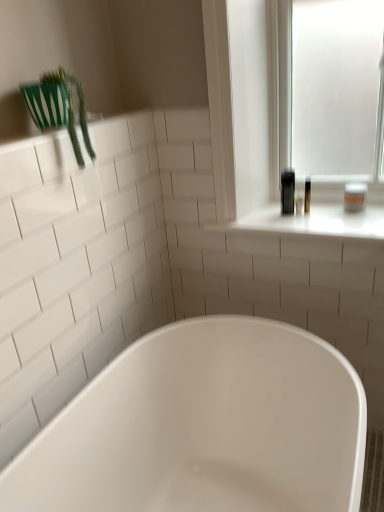
Measure the distance between point (80, 159) and camera.

Point (80, 159) and camera are 3.77 feet apart.

You are a GUI agent. You are given a task and a screenshot of the screen. Output one action in this format:
    pyautogui.click(x=<x>, y=<y>)
    Task: Click on the white glossy window sill at upper right
    
    Given the screenshot: What is the action you would take?
    pyautogui.click(x=309, y=223)

Describe the element at coordinates (204, 426) in the screenshot. I see `white glossy bathtub at center` at that location.

Measure the distance between white glossy bathtub at center and camera.

white glossy bathtub at center is 33.08 inches from camera.

You are a GUI agent. You are given a task and a screenshot of the screen. Output one action in this format:
    pyautogui.click(x=<x>, y=<y>)
    Task: Click on the green plastic plant at upper left
    This screenshot has height=512, width=384.
    Given the screenshot: What is the action you would take?
    pyautogui.click(x=72, y=110)

From the image's perspective, is green plastic plant at upper left below white glossy bathtub at center?

No, from the image's perspective, green plastic plant at upper left is not beneath white glossy bathtub at center.

What's the angular difference between green plastic plant at upper left and white glossy bathtub at center's facing directions?

There is a 0.916-degree angle between the facing directions of green plastic plant at upper left and white glossy bathtub at center.

Consider the image. Considering the sizes of objects green plastic plant at upper left and white glossy bathtub at center in the image provided, who is taller, green plastic plant at upper left or white glossy bathtub at center?

With more height is white glossy bathtub at center.

In the image, there is a white glossy bathtub at center. At what (x,y) coordinates should I click in order to perform the action: click on plant above it (from the image's perspective). Please return your answer as a coordinate pair (x, y). This screenshot has width=384, height=512. Looking at the image, I should click on (72, 110).

Is white glossy window sill at upper right positioned with its back to white matte jar at upper right?

No, white glossy window sill at upper right is not facing the opposite direction of white matte jar at upper right.

From the image's perspective, which one is positioned lower, white glossy window sill at upper right or white matte jar at upper right?

white glossy window sill at upper right is shown below in the image.

Is white glossy window sill at upper right not inside white matte jar at upper right?

That's correct, white glossy window sill at upper right is outside of white matte jar at upper right.

Does white glossy window sill at upper right have a smaller size compared to white matte jar at upper right?

No.

In the scene shown: Is white matte jar at upper right not inside green plastic plant at upper left?

Yes, white matte jar at upper right is not within green plastic plant at upper left.

Which object is closer to the camera taking this photo, white matte jar at upper right or green plastic plant at upper left?

green plastic plant at upper left is in front.

Where is `plant on the left side of white matte jar at upper right`? The image size is (384, 512). plant on the left side of white matte jar at upper right is located at coordinates (72, 110).

Between point (356, 201) and point (303, 234), which one is positioned in front?

The point (303, 234) is closer to the camera.

From the picture: Can you confirm if white matte jar at upper right is smaller than white glossy window sill at upper right?

Indeed, white matte jar at upper right has a smaller size compared to white glossy window sill at upper right.

In the scene shown: Is white matte jar at upper right wider or thinner than white glossy window sill at upper right?

Considering their sizes, white matte jar at upper right looks slimmer than white glossy window sill at upper right.

How distant is white matte jar at upper right from white glossy window sill at upper right?

white matte jar at upper right is 6.68 inches away from white glossy window sill at upper right.

Could white glossy window sill at upper right be considered to be inside green plastic plant at upper left?

That's incorrect, white glossy window sill at upper right is not inside green plastic plant at upper left.

Consider the image. From the image's perspective, between green plastic plant at upper left and white glossy window sill at upper right, which one is located above?

From the image's view, green plastic plant at upper left is above.

Is green plastic plant at upper left facing away from white glossy window sill at upper right?

No, green plastic plant at upper left is not facing away from white glossy window sill at upper right.

Find the location of a particular element. plant above the white glossy window sill at upper right (from a real-world perspective) is located at coordinates (72, 110).

Does point (305, 224) lie behind point (177, 359)?

Yes, it is.

From the image's perspective, between white glossy window sill at upper right and white glossy bathtub at center, who is located below?

white glossy bathtub at center.

Between white glossy window sill at upper right and white glossy bathtub at center, which one is positioned in front?

white glossy bathtub at center is more forward.

Is white glossy bathtub at center to the left or to the right of green plastic plant at upper left in the image?

white glossy bathtub at center is to the right of green plastic plant at upper left.

Are white glossy bathtub at center and green plastic plant at upper left making contact?

No, white glossy bathtub at center is not next to green plastic plant at upper left.

Find the location of a particular element. This screenshot has height=512, width=384. bathtub on the right of green plastic plant at upper left is located at coordinates (204, 426).

Does white glossy bathtub at center have a greater height compared to green plastic plant at upper left?

Yes, white glossy bathtub at center is taller than green plastic plant at upper left.

Where is `bathtub that appears in front of the green plastic plant at upper left`? The width and height of the screenshot is (384, 512). bathtub that appears in front of the green plastic plant at upper left is located at coordinates (204, 426).

Image resolution: width=384 pixels, height=512 pixels. In the image, there is a white matte jar at upper right. What are the coordinates of `window sill below it (from the image's perspective)` in the screenshot? It's located at (309, 223).

Looking at the image, which one is located further to green plastic plant at upper left, white glossy window sill at upper right or white glossy bathtub at center?

Among the two, white glossy bathtub at center is located further to green plastic plant at upper left.

When comparing their distances from green plastic plant at upper left, does white matte jar at upper right or white glossy bathtub at center seem further?

white matte jar at upper right is further to green plastic plant at upper left.

Looking at the image, which one is located closer to white glossy window sill at upper right, white glossy bathtub at center or white matte jar at upper right?

The object closer to white glossy window sill at upper right is white matte jar at upper right.

Which object lies nearer to the anchor point white glossy window sill at upper right, green plastic plant at upper left or white glossy bathtub at center?

Among the two, white glossy bathtub at center is located nearer to white glossy window sill at upper right.

Estimate the real-world distances between objects in this image. Which object is further from white matte jar at upper right, green plastic plant at upper left or white glossy bathtub at center?

green plastic plant at upper left is further to white matte jar at upper right.

Estimate the real-world distances between objects in this image. Which object is further from green plastic plant at upper left, white glossy window sill at upper right or white matte jar at upper right?

white matte jar at upper right.

Looking at the image, which one is located further to white glossy bathtub at center, green plastic plant at upper left or white matte jar at upper right?

green plastic plant at upper left lies further to white glossy bathtub at center than the other object.

Which object lies further to the anchor point white glossy window sill at upper right, white matte jar at upper right or green plastic plant at upper left?

green plastic plant at upper left is positioned further to the anchor white glossy window sill at upper right.

You are a GUI agent. You are given a task and a screenshot of the screen. Output one action in this format:
    pyautogui.click(x=<x>, y=<y>)
    Task: Click on the toiletry between green plastic plant at upper left and white glossy bathtub at center from top to bottom
    
    Given the screenshot: What is the action you would take?
    pyautogui.click(x=355, y=197)

Where is `window sill between green plastic plant at upper left and white glossy bathtub at center vertically`? The image size is (384, 512). window sill between green plastic plant at upper left and white glossy bathtub at center vertically is located at coordinates (309, 223).

The height and width of the screenshot is (512, 384). I want to click on window sill between white glossy bathtub at center and white matte jar at upper right along the z-axis, so click(x=309, y=223).

The image size is (384, 512). Find the location of `window sill located between green plastic plant at upper left and white matte jar at upper right in the left-right direction`. window sill located between green plastic plant at upper left and white matte jar at upper right in the left-right direction is located at coordinates click(309, 223).